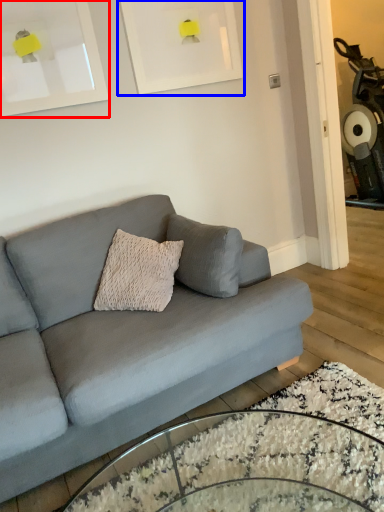
Question: Which object appears closest to the camera in this image, picture frame (highlighted by a red box) or picture frame (highlighted by a blue box)?

Choices:
 (A) picture frame
 (B) picture frame

Answer: (A)